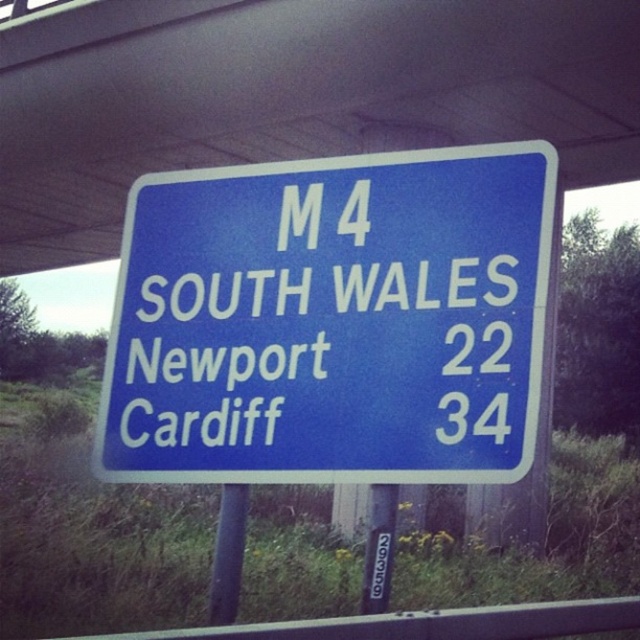
You are a driver approaching the M4 motorway in South Wales and see the blue plastic sign at upper center. According to the sign, which city is closer, Newport or Cardiff?

Newport is closer to the blue plastic sign at upper center because it is listed with a distance of 22 miles compared to Cardiff at 34 miles.

You are a driver approaching the blue glossy sign at center attached to the black metal pole at center. If you want to go to Cardiff, which direction should you turn after passing the sign?

The question cannot be determined with the provided information. The sign only provides distances to Newport and Cardiff but does not indicate directions. You need to consult a map or GPS for the correct route.